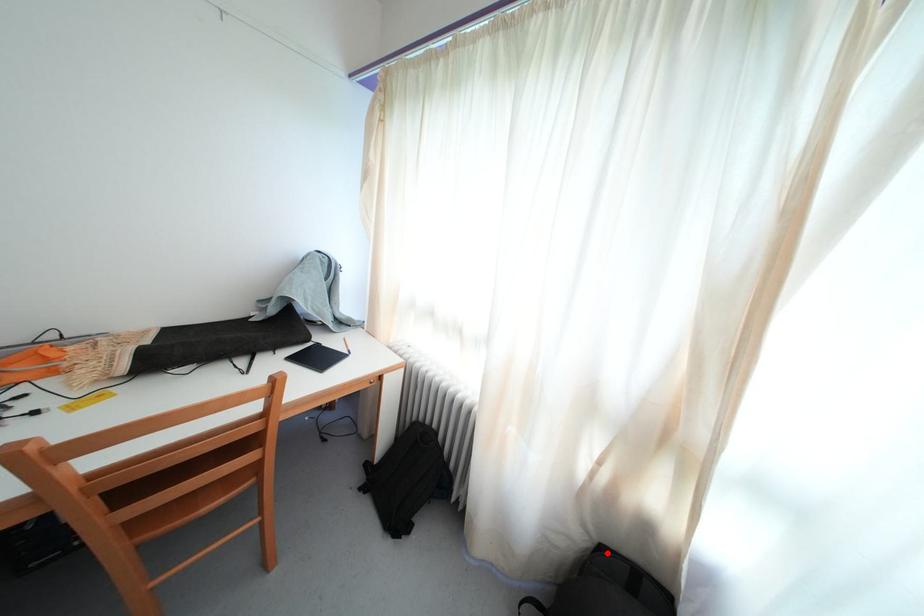
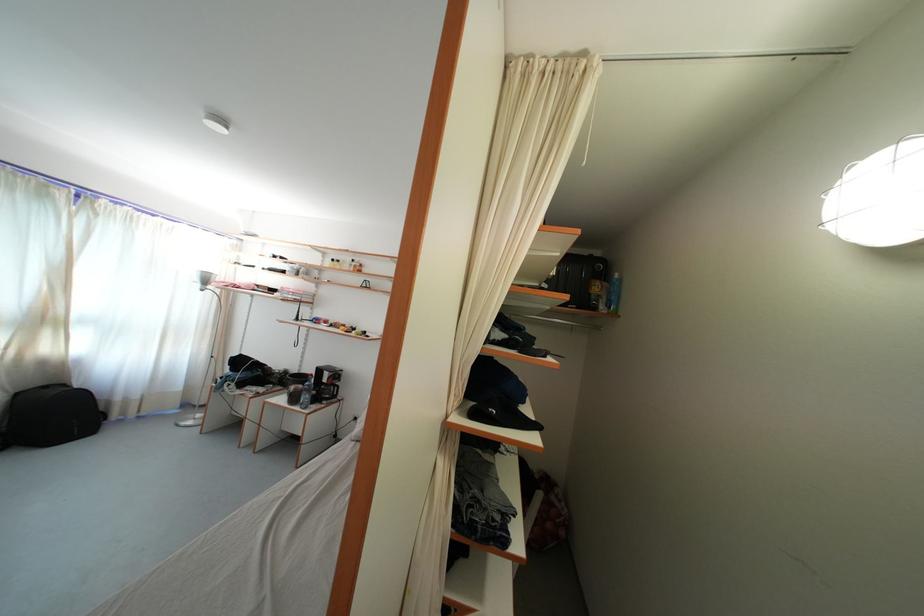
Locate, in the second image, the point that corresponds to the highlighted location in the first image.

(23, 400)